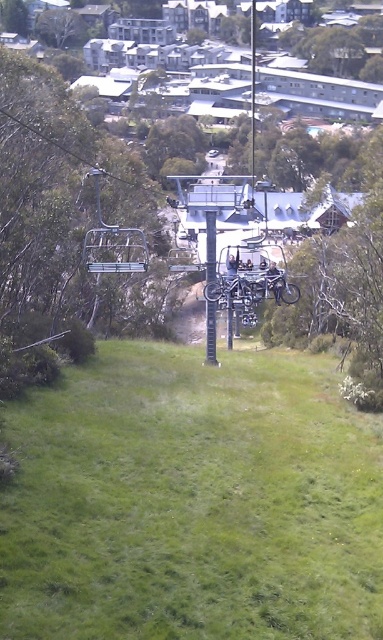
Based on the photo, you are a photographer standing at the base of the ski lift. You want to take a photo of the metallic pole at center without the green grassy at center blocking it. Is the pole visible above the grass?

The green grassy at center is much taller than the metallic pole at center, so the pole is likely blocked by the grass and not visible above it.

You are standing at the base of the ski lift and want to know if the two points, point (114, 266) and point (232, 269), are aligned along the same path. Can you determine if one is in front of the other from your current position?

Yes, point (114, 266) is in front of point (232, 269), so they are aligned along the same path with the first point closer to you.

You are planning to set up a picnic on the green grassy at center near the metallic pole at center. Which object will occupy more space in your picnic area?

The green grassy at center is larger in size than the metallic pole at center, so it will occupy more space in the picnic area.